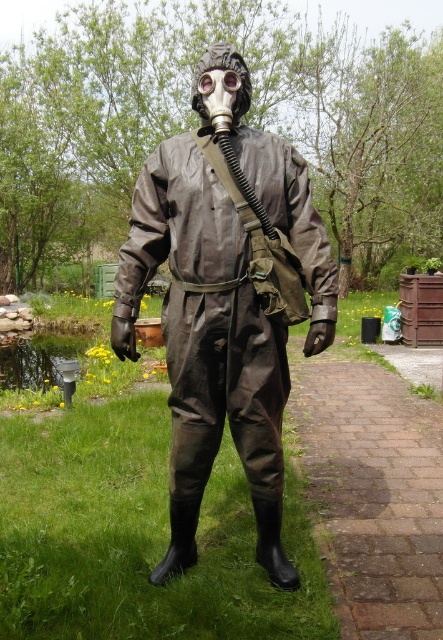
Question: Can you confirm if matte brown jumpsuit at center is thinner than transparent plastic goggles at center?

Choices:
 (A) no
 (B) yes

Answer: (A)

Question: Among these objects, which one is farthest from the camera?

Choices:
 (A) matte brown jumpsuit at center
 (B) brick pavement at lower right

Answer: (B)

Question: Which object is the closest to the transparent plastic goggles at center?

Choices:
 (A) brick pavement at lower right
 (B) matte brown jumpsuit at center

Answer: (B)

Question: In this image, where is matte brown jumpsuit at center located relative to transparent plastic goggles at center?

Choices:
 (A) below
 (B) above

Answer: (A)

Question: Is matte brown jumpsuit at center to the right of brick pavement at lower right from the viewer's perspective?

Choices:
 (A) no
 (B) yes

Answer: (A)

Question: Which of the following is the farthest from the observer?

Choices:
 (A) brick pavement at lower right
 (B) transparent plastic goggles at center

Answer: (A)